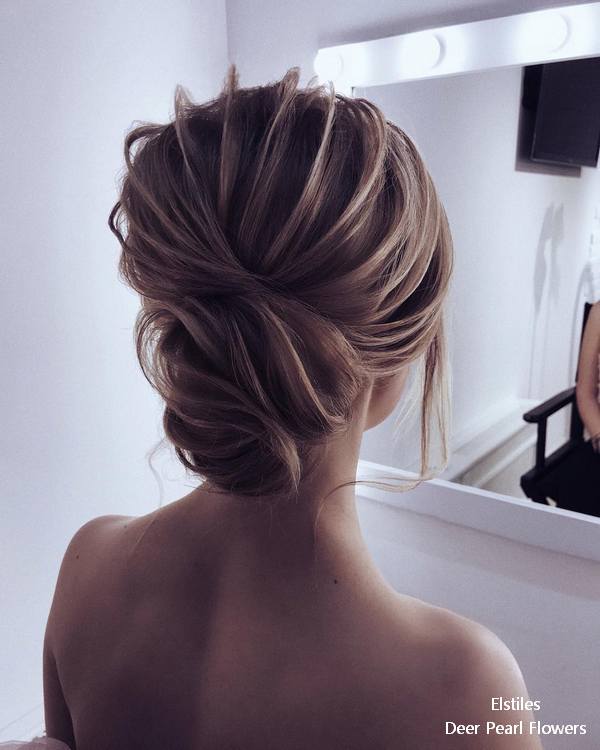
This screenshot has width=600, height=750. In order to click on black chair frame in this screenshot , I will do `click(558, 404)`.